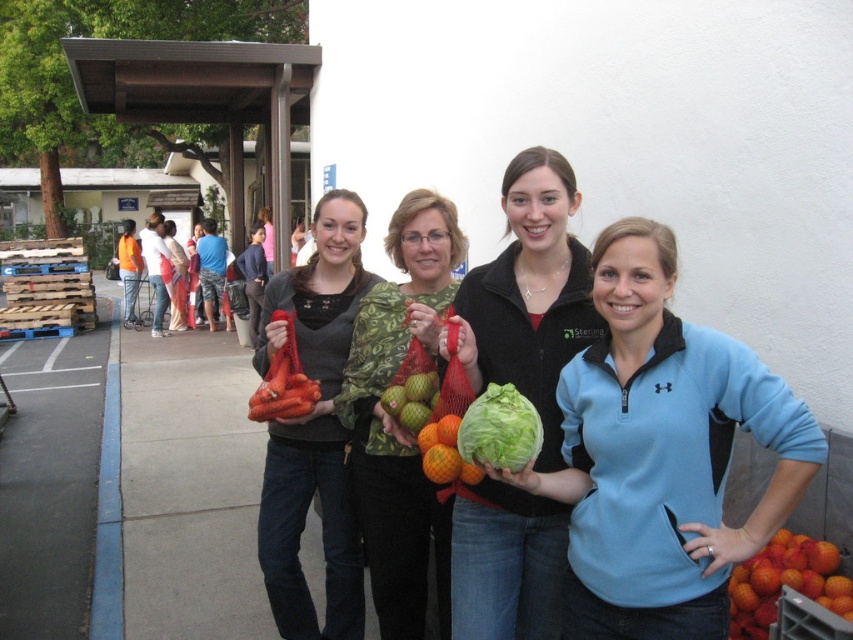
Question: Which object appears closest to the camera in this image?

Choices:
 (A) orange mesh bag of carrots at center
 (B) green textured shirt at center
 (C) orange matte/orange mesh bag at center
 (D) orange matte/orange at lower right

Answer: (D)

Question: Is green leafy lettuce at center to the left of orange matte/orange mesh bag at center from the viewer's perspective?

Choices:
 (A) no
 (B) yes

Answer: (A)

Question: Which point appears farthest from the camera in this image?

Choices:
 (A) (778, 476)
 (B) (556, 408)
 (C) (827, 600)

Answer: (B)

Question: Does green textured shirt at center appear on the left side of orange mesh bag of carrots at center?

Choices:
 (A) yes
 (B) no

Answer: (B)

Question: Can you confirm if green textured shirt at center is positioned to the left of orange matte/orange at lower right?

Choices:
 (A) no
 (B) yes

Answer: (B)

Question: Which object is positioned closest to the orange matte/orange at lower right?

Choices:
 (A) green leafy lettuce at center
 (B) matte orange carrots at center
 (C) light blue fleece jacket at center
 (D) green leafy cabbage at center

Answer: (C)